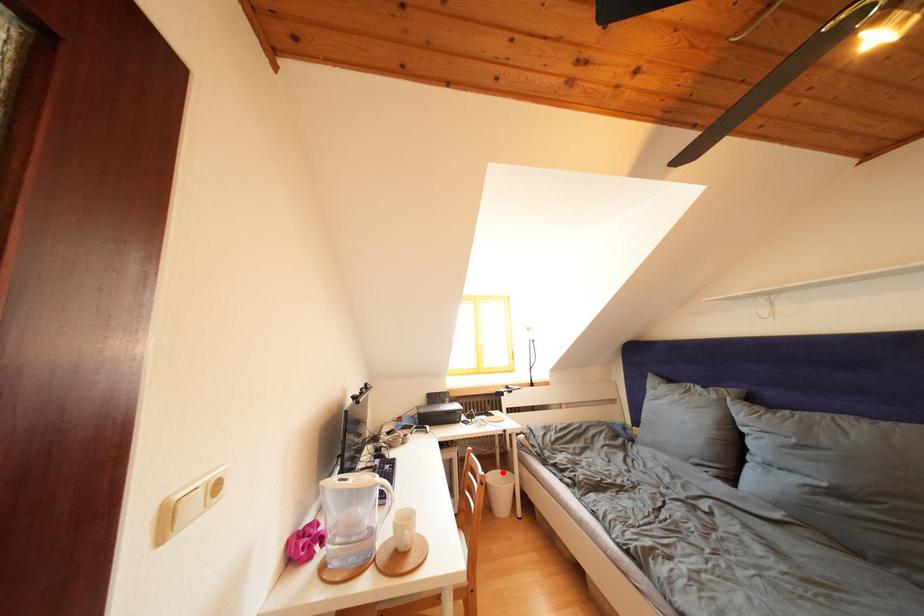
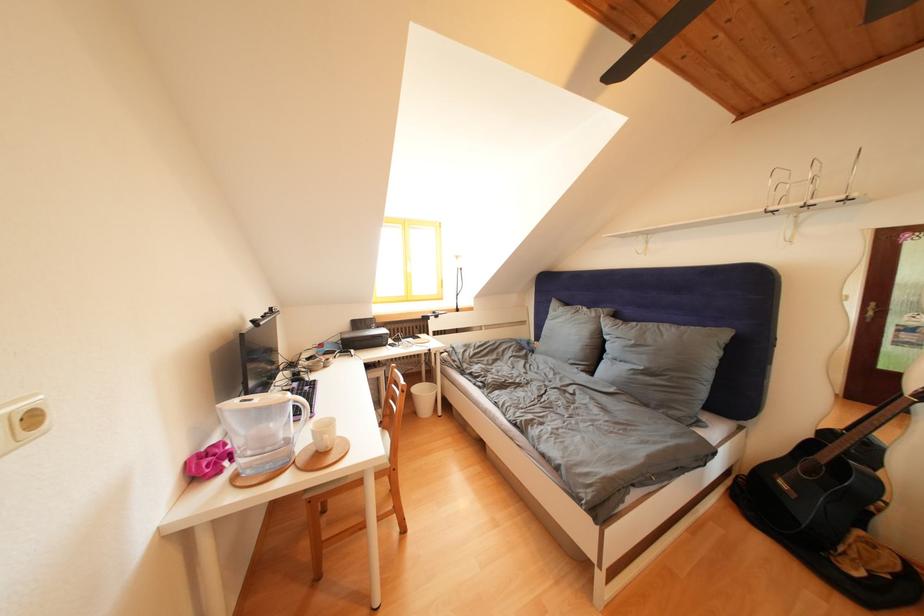
Question: A red point is marked in image1. In image2, is the corresponding 3D point closer to the camera or farther? Reply with the corresponding letter.

Choices:
 (A) The corresponding 3D point is closer.
 (B) The corresponding 3D point is farther.

Answer: (A)